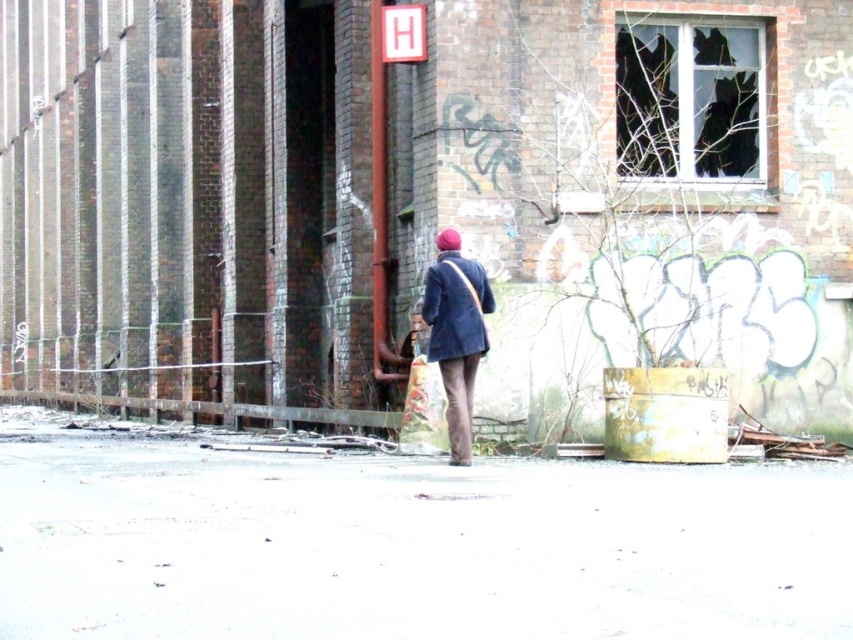
Measure the distance from dark blue fabric coat at center to dark blue woolen sweater at center.

7.95 centimeters

Does dark blue fabric coat at center have a lesser width compared to dark blue woolen sweater at center?

Indeed, dark blue fabric coat at center has a lesser width compared to dark blue woolen sweater at center.

Is point (461, 289) positioned before point (442, 339)?

Yes, it is in front of point (442, 339).

Locate an element on the screen. dark blue fabric coat at center is located at coordinates point(456,333).

Who is higher up, rusty metal fence at lower left or dark blue woolen sweater at center?

dark blue woolen sweater at center is higher up.

The width and height of the screenshot is (853, 640). What do you see at coordinates (213, 406) in the screenshot?
I see `rusty metal fence at lower left` at bounding box center [213, 406].

Find the location of a particular element. rusty metal fence at lower left is located at coordinates (213, 406).

Which is below, concrete pavement at center or dark blue woolen sweater at center?

concrete pavement at center

Locate an element on the screen. Image resolution: width=853 pixels, height=640 pixels. concrete pavement at center is located at coordinates (408, 545).

Where is `concrete pavement at center`? concrete pavement at center is located at coordinates (408, 545).